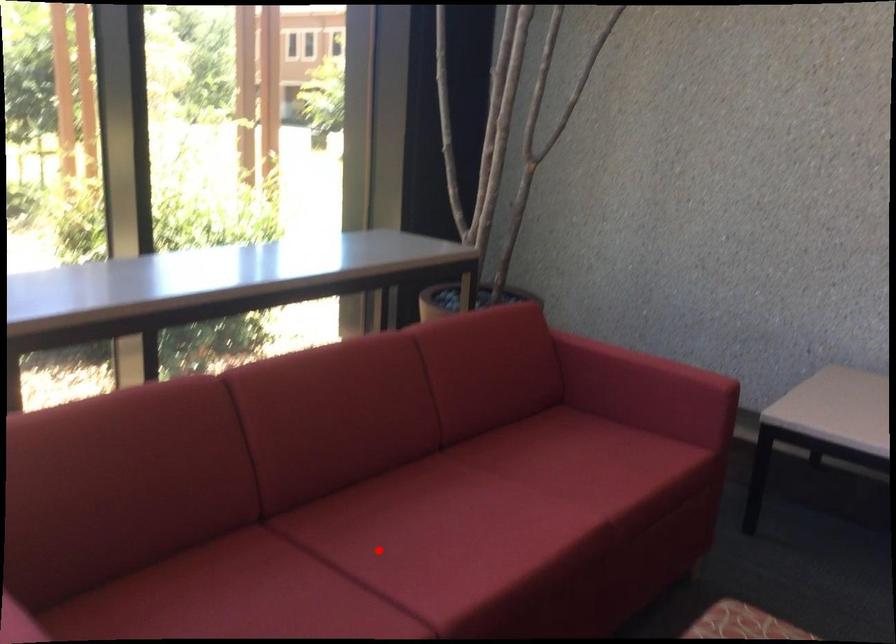
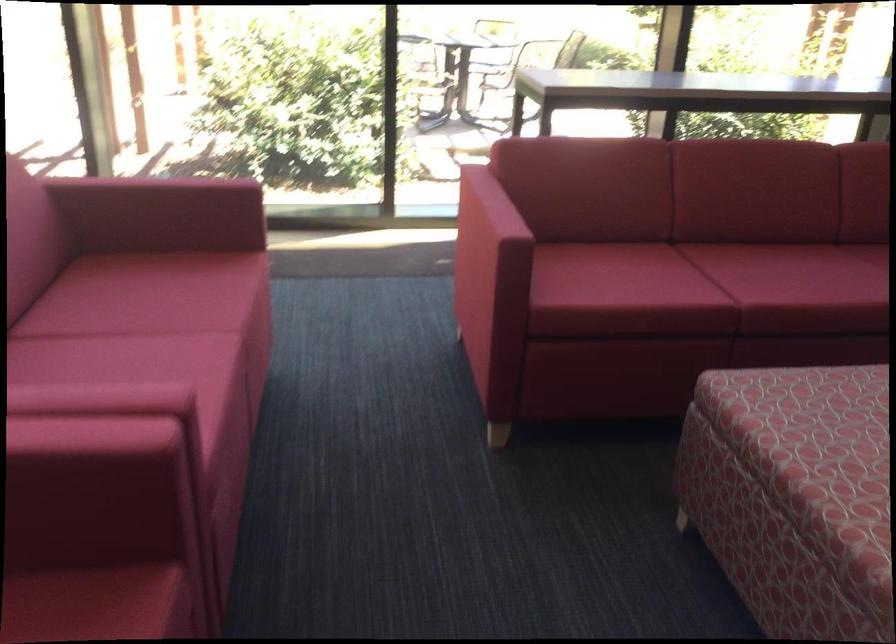
Question: A red point is marked in image1. In image2, is the corresponding 3D point closer to the camera or farther? Reply with the corresponding letter.

Choices:
 (A) The corresponding 3D point is closer.
 (B) The corresponding 3D point is farther.

Answer: (B)